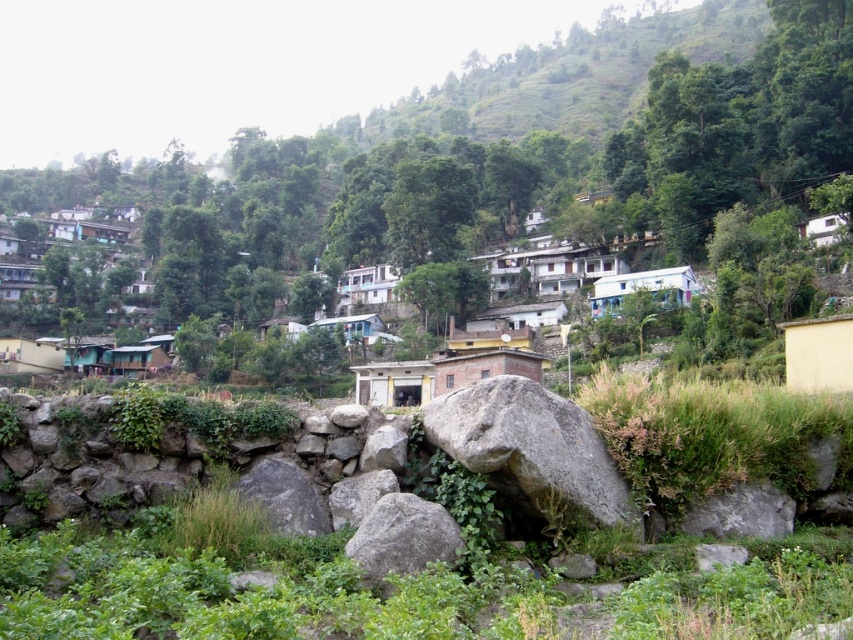
Between white painted wood hut at center and teal painted wood hut at center, which one has less height?

Standing shorter between the two is white painted wood hut at center.

Consider the image. Who is taller, white painted wood hut at center or teal painted wood hut at center?

teal painted wood hut at center is taller.

Which is behind, point (383, 326) or point (105, 371)?

The point (105, 371) is behind.

The height and width of the screenshot is (640, 853). Find the location of `white painted wood hut at center`. white painted wood hut at center is located at coordinates (357, 326).

Who is lower down, gray rough boulder at center or white painted wood hut at center?

gray rough boulder at center is below.

Does gray rough boulder at center have a greater width compared to white painted wood hut at center?

In fact, gray rough boulder at center might be narrower than white painted wood hut at center.

Is point (357, 552) closer to viewer compared to point (351, 337)?

Yes, point (357, 552) is in front of point (351, 337).

The image size is (853, 640). I want to click on gray rough boulder at center, so [403, 536].

Is point (792, 346) positioned after point (77, 362)?

No, it is in front of (77, 362).

Looking at this image, can you confirm if yellow matte wall at right is taller than teal painted wood hut at center?

Correct, yellow matte wall at right is much taller as teal painted wood hut at center.

Does point (822, 380) lie behind point (93, 356)?

No, it is not.

Where is `yellow matte wall at right`? The width and height of the screenshot is (853, 640). yellow matte wall at right is located at coordinates (817, 353).